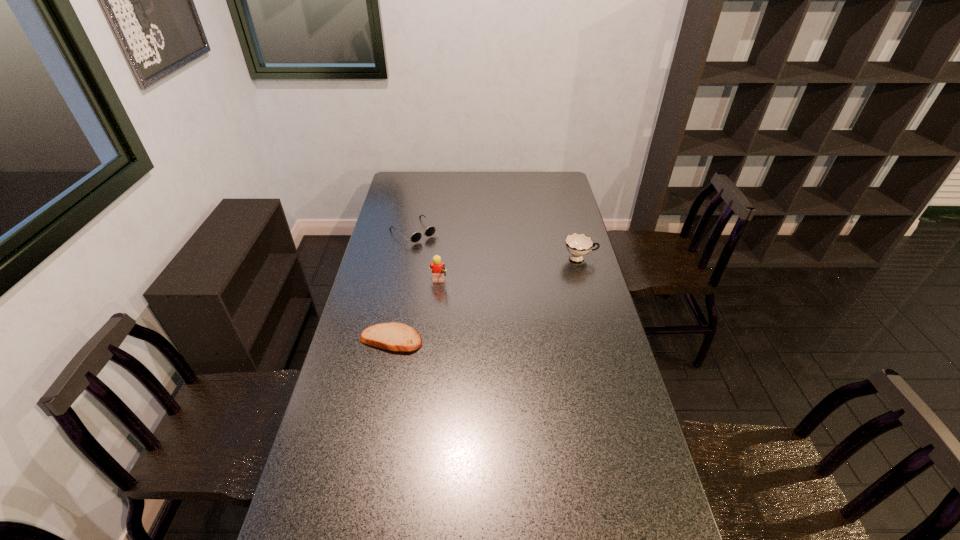
This screenshot has height=540, width=960. Find the location of `vacant area that lies between the cup and the pita bread`. vacant area that lies between the cup and the pita bread is located at coordinates (486, 299).

Identify the location of free space between the tallest object and the shortest object. 415,312.

Image resolution: width=960 pixels, height=540 pixels. I want to click on vacant area that lies between the tallest object and the shortest object, so click(x=415, y=312).

At what (x,y) coordinates should I click in order to perform the action: click on free space between the shortest object and the sunglasses. Please return your answer as a coordinate pair (x, y). The width and height of the screenshot is (960, 540). Looking at the image, I should click on (402, 286).

This screenshot has height=540, width=960. Identify the location of object that stands as the closest to the tallest object. (393, 336).

Identify the location of the second closest object to the rightmost object. (429, 231).

Locate an element on the screen. free space that satisfies the following two spatial constraints: 1. on the front side of the second tallest object; 2. on the side of the sunglasses with the handle is located at coordinates 409,259.